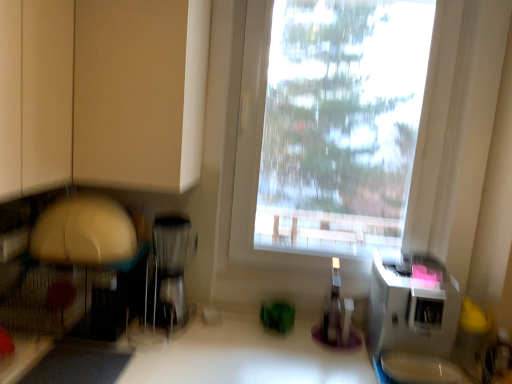
Question: Does transparent plastic bottle at center have a larger size compared to satin silver coffee maker at center, marked as the second appliance in a right-to-left arrangement?

Choices:
 (A) yes
 (B) no

Answer: (B)

Question: Is transparent plastic bottle at center positioned in front of satin silver coffee maker at center, the first appliance when ordered from left to right?

Choices:
 (A) no
 (B) yes

Answer: (A)

Question: From a real-world perspective, is transparent plastic bottle at center positioned under satin silver coffee maker at center, marked as the second appliance in a right-to-left arrangement, based on gravity?

Choices:
 (A) yes
 (B) no

Answer: (A)

Question: Is transparent plastic bottle at center turned away from satin silver coffee maker at center, the first appliance when ordered from left to right?

Choices:
 (A) no
 (B) yes

Answer: (A)

Question: From a real-world perspective, is transparent plastic bottle at center located higher than satin silver coffee maker at center, marked as the second appliance in a right-to-left arrangement?

Choices:
 (A) no
 (B) yes

Answer: (A)

Question: In terms of width, does transparent plastic window at center look wider or thinner when compared to matte beige cabinet at upper left?

Choices:
 (A) thin
 (B) wide

Answer: (A)

Question: Is transparent plastic window at center in front of or behind matte beige cabinet at upper left in the image?

Choices:
 (A) behind
 (B) front

Answer: (A)

Question: Considering the relative positions of transparent plastic window at center and matte beige cabinet at upper left in the image provided, is transparent plastic window at center to the left or to the right of matte beige cabinet at upper left?

Choices:
 (A) left
 (B) right

Answer: (B)

Question: From a real-world perspective, is transparent plastic window at center physically located above or below matte beige cabinet at upper left?

Choices:
 (A) below
 (B) above

Answer: (A)

Question: From the image's perspective, relative to transparent plastic bottle at center, is transparent plastic window at center above or below?

Choices:
 (A) above
 (B) below

Answer: (A)

Question: Considering the positions of point [386, 152] and point [321, 336], is point [386, 152] closer or farther from the camera than point [321, 336]?

Choices:
 (A) closer
 (B) farther

Answer: (B)

Question: From a real-world perspective, is transparent plastic window at center above or below transparent plastic bottle at center?

Choices:
 (A) below
 (B) above

Answer: (B)

Question: Considering the positions of transparent plastic window at center and transparent plastic bottle at center in the image, is transparent plastic window at center bigger or smaller than transparent plastic bottle at center?

Choices:
 (A) big
 (B) small

Answer: (A)

Question: From the image's perspective, is transparent plastic bottle at center located above or below satin silver coffee maker at center, marked as the second appliance in a right-to-left arrangement?

Choices:
 (A) below
 (B) above

Answer: (A)

Question: Considering the positions of point (326, 339) and point (159, 241), is point (326, 339) closer or farther from the camera than point (159, 241)?

Choices:
 (A) closer
 (B) farther

Answer: (A)